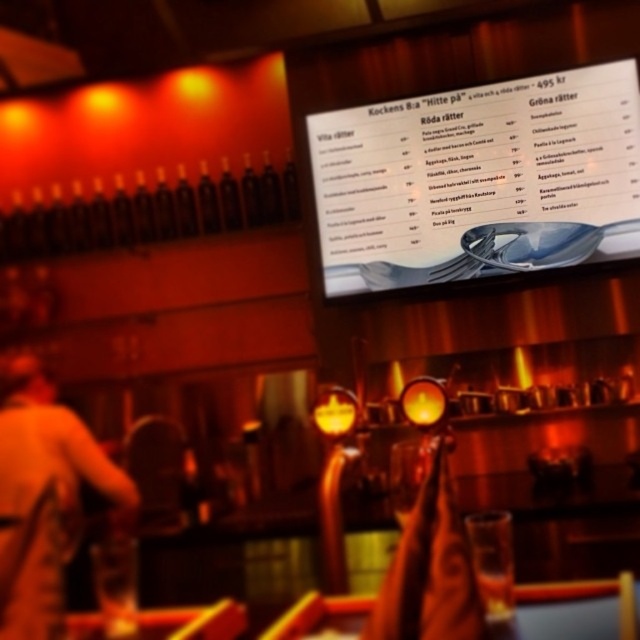
Question: Is white glossy menu at center positioned behind light brown leather jacket at lower left?

Choices:
 (A) no
 (B) yes

Answer: (B)

Question: Is white glossy menu at center thinner than light brown leather jacket at lower left?

Choices:
 (A) yes
 (B) no

Answer: (B)

Question: Can you confirm if white glossy menu at center is wider than light brown leather jacket at lower left?

Choices:
 (A) no
 (B) yes

Answer: (B)

Question: Which point is farther to the camera?

Choices:
 (A) [60, 612]
 (B) [577, 83]

Answer: (B)

Question: Among these objects, which one is farthest from the camera?

Choices:
 (A) light brown leather jacket at lower left
 (B) white glossy menu at center

Answer: (B)